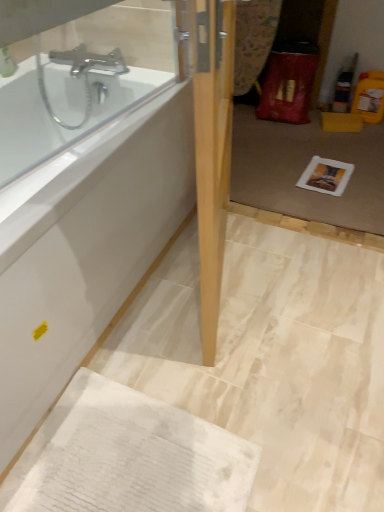
Question: From the image's perspective, would you say white glossy bathtub at upper left is shown under white paper at center?

Choices:
 (A) no
 (B) yes

Answer: (B)

Question: Is there a large distance between white glossy bathtub at upper left and white paper at center?

Choices:
 (A) yes
 (B) no

Answer: (A)

Question: Does white glossy bathtub at upper left have a lesser width compared to white paper at center?

Choices:
 (A) yes
 (B) no

Answer: (B)

Question: Is white glossy bathtub at upper left positioned with its back to white paper at center?

Choices:
 (A) no
 (B) yes

Answer: (A)

Question: Considering the relative sizes of white glossy bathtub at upper left and white paper at center in the image provided, is white glossy bathtub at upper left wider than white paper at center?

Choices:
 (A) no
 (B) yes

Answer: (B)

Question: Is the surface of white glossy bathtub at upper left in direct contact with white paper at center?

Choices:
 (A) no
 (B) yes

Answer: (A)

Question: Is there a large distance between light wood door at center and white glossy bathtub at upper left?

Choices:
 (A) no
 (B) yes

Answer: (A)

Question: Does light wood door at center appear on the right side of white glossy bathtub at upper left?

Choices:
 (A) no
 (B) yes

Answer: (B)

Question: Is light wood door at center positioned behind white glossy bathtub at upper left?

Choices:
 (A) no
 (B) yes

Answer: (A)

Question: Is light wood door at center wider than white glossy bathtub at upper left?

Choices:
 (A) yes
 (B) no

Answer: (B)

Question: Can white glossy bathtub at upper left be found inside light wood door at center?

Choices:
 (A) no
 (B) yes

Answer: (A)

Question: From the image's perspective, is light wood door at center on top of white glossy bathtub at upper left?

Choices:
 (A) yes
 (B) no

Answer: (A)

Question: Considering the relative sizes of white glossy bathtub at upper left and transparent glass door at center in the image provided, is white glossy bathtub at upper left taller than transparent glass door at center?

Choices:
 (A) yes
 (B) no

Answer: (B)